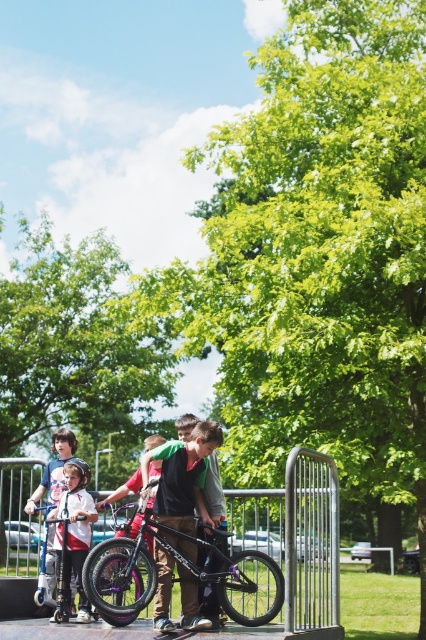
You are a parent at the park and see your child wearing the matte black shirt at center and riding the shiny purple bicycle at center. From your perspective, which object is closer to the ground?

The shiny purple bicycle at center is closer to the ground because it is positioned below the matte black shirt at center.

You are a photographer standing at the edge of the park. You want to take a photo of the matte black shirt at center and the white matte scooter at lower left. However, you notice that the silver railing is blocking your view. Can you still capture both objects in the same frame without moving the railing?

The matte black shirt at center is much taller than the white matte scooter at lower left. Since the railing is blocking the view, you can adjust your angle to include the taller matte black shirt at center above the railing and the lower white matte scooter at lower left below the railing, allowing both to be visible in the frame.

You are a parent supervising children in the park. You see the shiny purple bicycle at center and the white matte scooter at lower left. Which object is located to the right of the other?

The shiny purple bicycle at center is positioned on the right side of the white matte scooter at lower left.